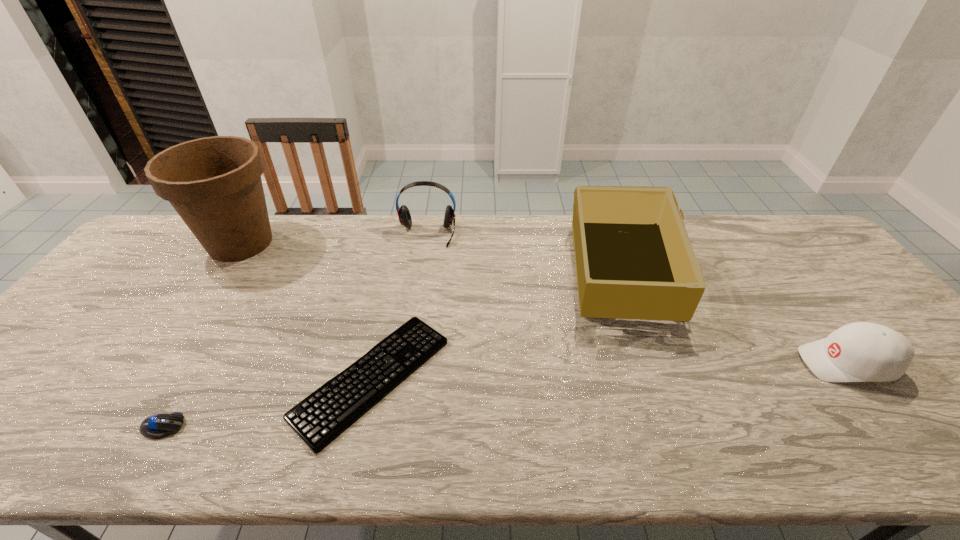
Where is `flowerpot`? The height and width of the screenshot is (540, 960). flowerpot is located at coordinates (214, 183).

At what (x,y) coordinates should I click in order to perform the action: click on the fifth object from left to right. Please return your answer as a coordinate pair (x, y). The width and height of the screenshot is (960, 540). Looking at the image, I should click on (633, 257).

Locate an element on the screen. headset is located at coordinates (403, 212).

Identify the location of baseball cap. (862, 351).

What are the coordinates of `the fourth tallest object` in the screenshot? It's located at point(862,351).

Find the location of a particular element. The image size is (960, 540). the fifth tallest object is located at coordinates (160, 425).

I want to click on the shortest object, so click(321, 417).

What are the coordinates of `free location located on the left of the tallest object` in the screenshot? It's located at (147, 243).

Where is `vacant area located 0.240m on the left of the second object from right to left`? vacant area located 0.240m on the left of the second object from right to left is located at coordinates (487, 270).

Find the location of a particular element. This screenshot has width=960, height=540. free spot located with the microphone attached to the side of the headset is located at coordinates (423, 260).